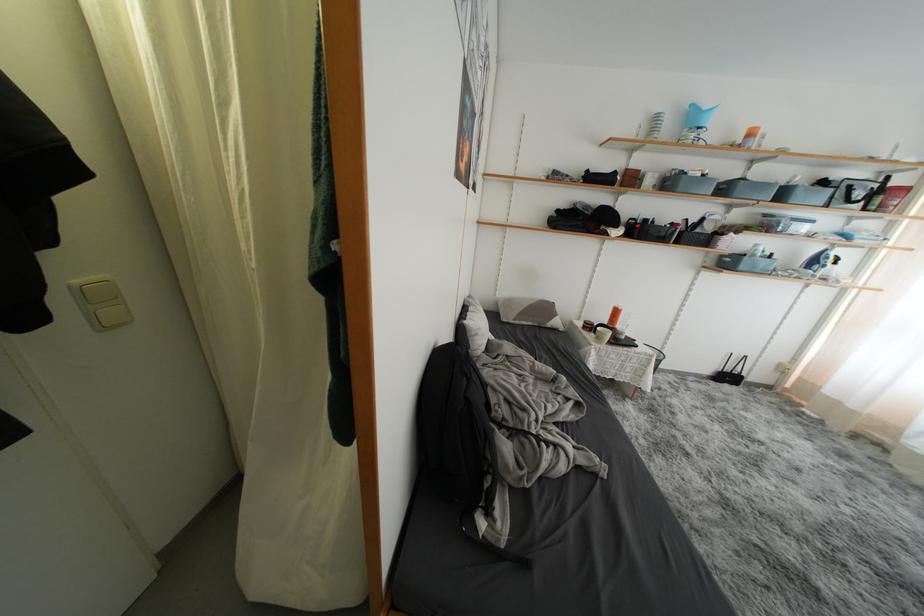
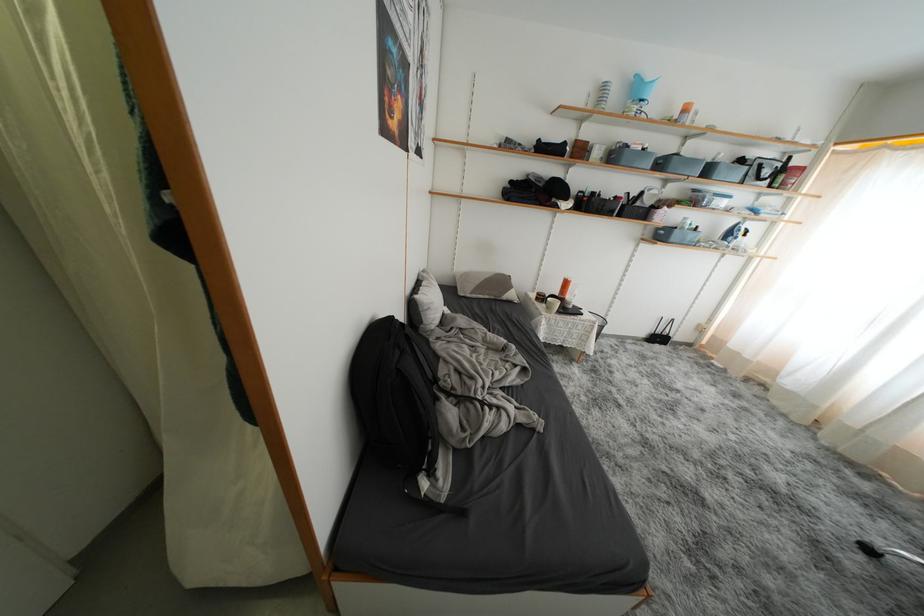
Find the pixel in the second image that matches (x=716, y=267) in the first image.

(654, 238)